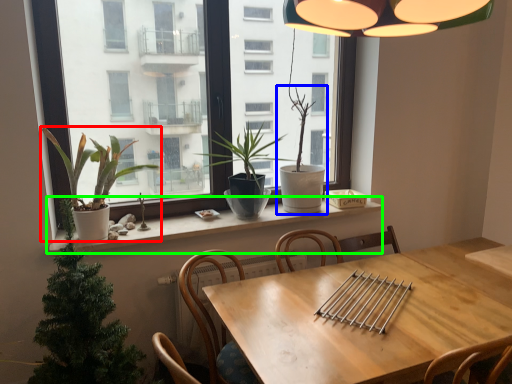
Question: Which object is the closest to the houseplant (highlighted by a red box)? Choose among these: houseplant (highlighted by a blue box) or window sill (highlighted by a green box).

Choices:
 (A) houseplant
 (B) window sill

Answer: (B)